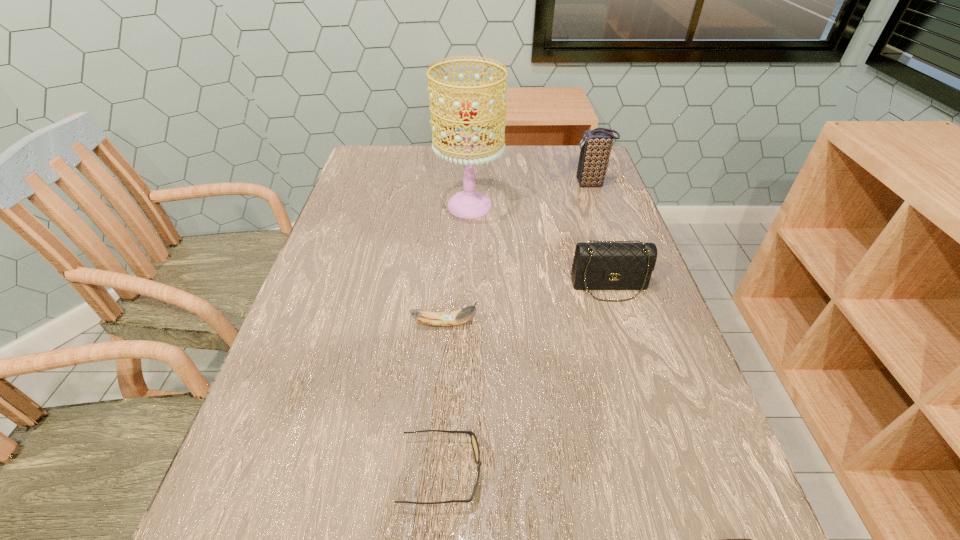
This screenshot has width=960, height=540. I want to click on free space at the far left corner, so pyautogui.click(x=386, y=153).

Locate an element on the screen. This screenshot has height=540, width=960. free space at the far right corner is located at coordinates (568, 154).

Identify the location of free space that is in between the second shortest object and the fourth farthest object. (444, 397).

Identify the location of free space between the fifth farthest object and the banana. Image resolution: width=960 pixels, height=540 pixels. (444, 397).

Find the location of `free point between the taller clutch bag and the third nearest object`. free point between the taller clutch bag and the third nearest object is located at coordinates (518, 254).

You are a GUI agent. You are given a task and a screenshot of the screen. Output one action in this format:
    pyautogui.click(x=<x>, y=<y>)
    Task: Click on the empty space between the farther clutch bag and the lampshade
    The height and width of the screenshot is (540, 960).
    Given the screenshot: What is the action you would take?
    pyautogui.click(x=531, y=195)

Identify the location of free space between the lampshade and the fourth shortest object. click(x=540, y=246).

This screenshot has width=960, height=540. In order to click on free point between the farther clutch bag and the tallest object in this screenshot , I will do `click(531, 195)`.

This screenshot has height=540, width=960. Identify the location of empty location between the fourth nearest object and the tallest object. (540, 246).

Where is `the second closest object to the lampshade`? the second closest object to the lampshade is located at coordinates (600, 265).